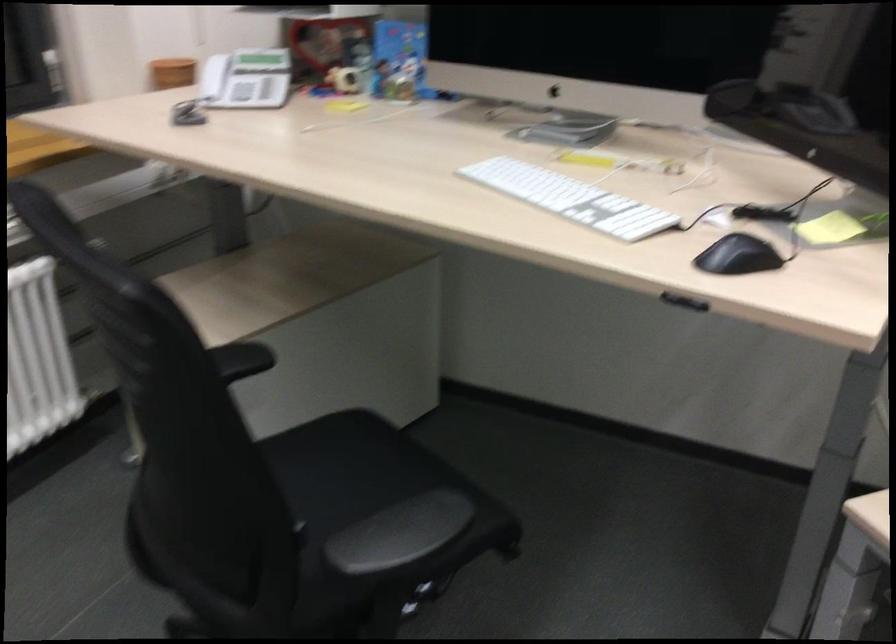
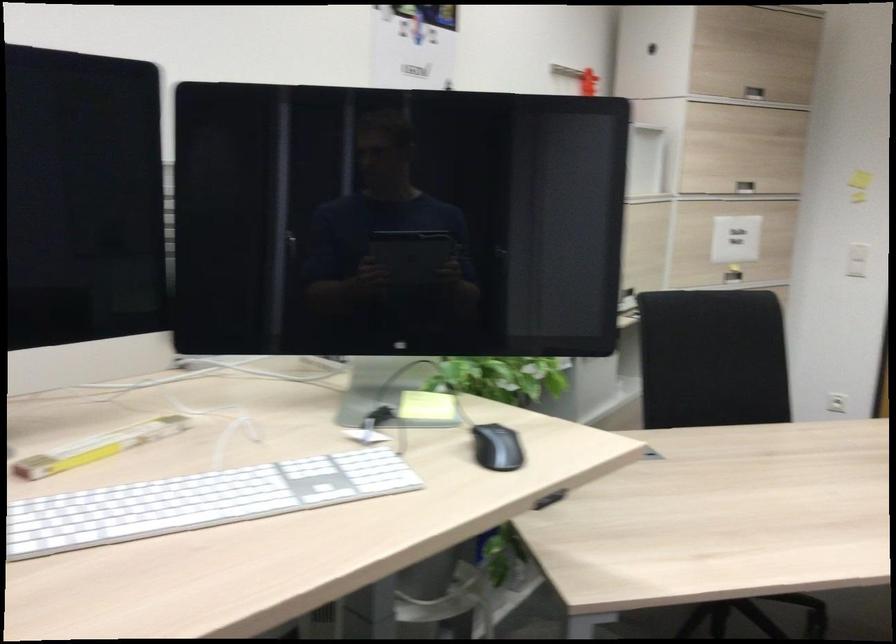
The point at (610, 156) is marked in the first image. Where is the corresponding point in the second image?

(98, 447)